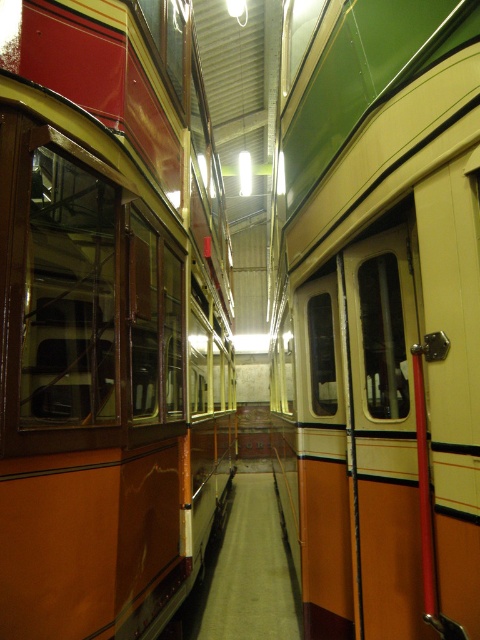
Question: Does matte orange bus at left appear over matte orange door at center?

Choices:
 (A) no
 (B) yes

Answer: (B)

Question: Which point is farther from the camera taking this photo?

Choices:
 (A) (334, 157)
 (B) (56, 452)

Answer: (A)

Question: Can you confirm if matte orange bus at left is wider than matte orange door at center?

Choices:
 (A) yes
 (B) no

Answer: (A)

Question: Does matte orange bus at left have a larger size compared to matte orange door at center?

Choices:
 (A) yes
 (B) no

Answer: (B)

Question: Which of the following is the closest to the observer?

Choices:
 (A) (382, 420)
 (B) (171, 515)

Answer: (A)